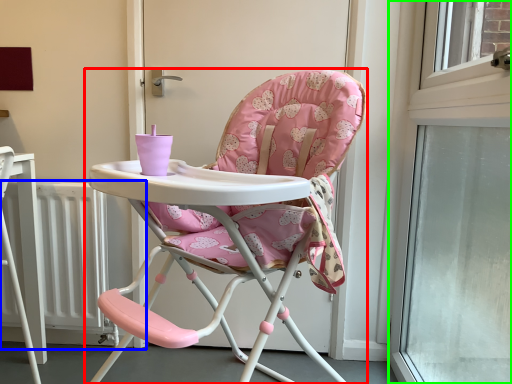
Question: Estimate the real-world distances between objects in this image. Which object is farther from chair (highlighted by a red box), radiator (highlighted by a blue box) or window (highlighted by a green box)?

Choices:
 (A) radiator
 (B) window

Answer: (A)